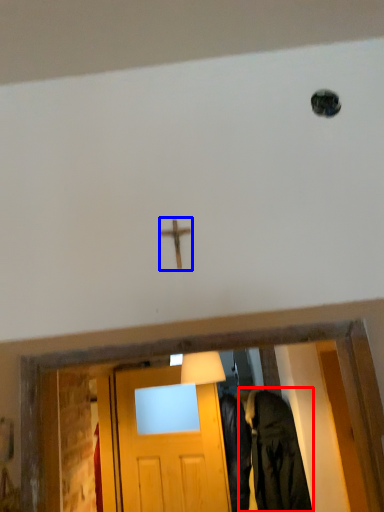
Question: Among these objects, which one is farthest to the camera, clothing (highlighted by a red box) or crucifix (highlighted by a blue box)?

Choices:
 (A) clothing
 (B) crucifix

Answer: (A)